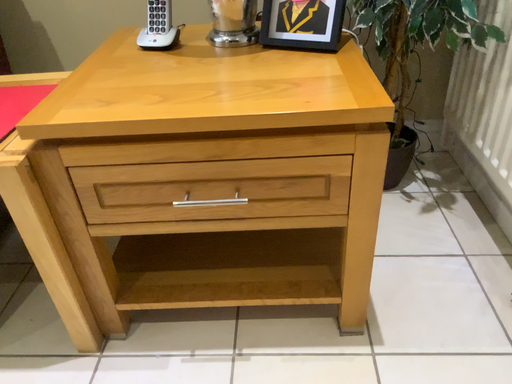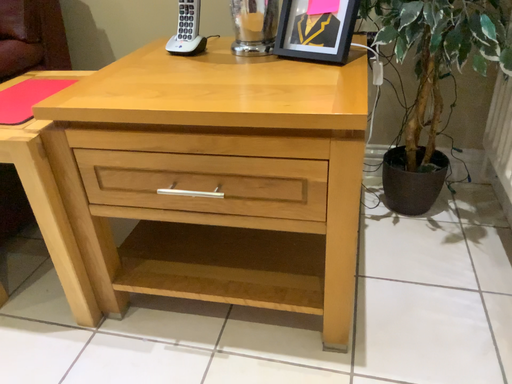
Question: Which way did the camera rotate in the video?

Choices:
 (A) rotated left
 (B) rotated right

Answer: (A)